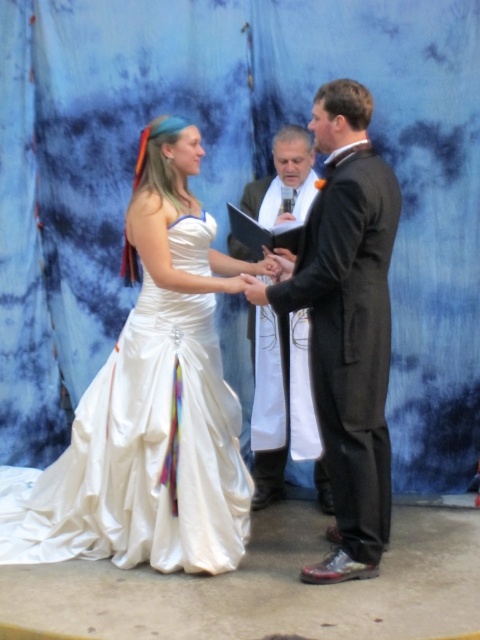
Does satin white dress at center have a lesser height compared to shiny black suit at center?

Indeed, satin white dress at center has a lesser height compared to shiny black suit at center.

At what (x,y) coordinates should I click in order to perform the action: click on satin white dress at center. Please return your answer as a coordinate pair (x, y). The image size is (480, 640). Looking at the image, I should click on (144, 454).

Based on the photo, does white satin dress at center have a greater width compared to black satin suit at center?

Yes, white satin dress at center is wider than black satin suit at center.

Is white satin dress at center smaller than black satin suit at center?

Actually, white satin dress at center might be larger than black satin suit at center.

Which is behind, point (22, 532) or point (288, 148)?

Point (288, 148)

Identify the location of white satin dress at center. (156, 401).

From the picture: Who is shorter, shiny black suit at center or black satin suit at center?

black satin suit at center

Is shiny black suit at center to the right of black satin suit at center from the viewer's perspective?

Yes, shiny black suit at center is to the right of black satin suit at center.

Is point (358, 118) closer to camera compared to point (276, 387)?

That is True.

Find the location of `shiny black suit at center`. shiny black suit at center is located at coordinates (347, 324).